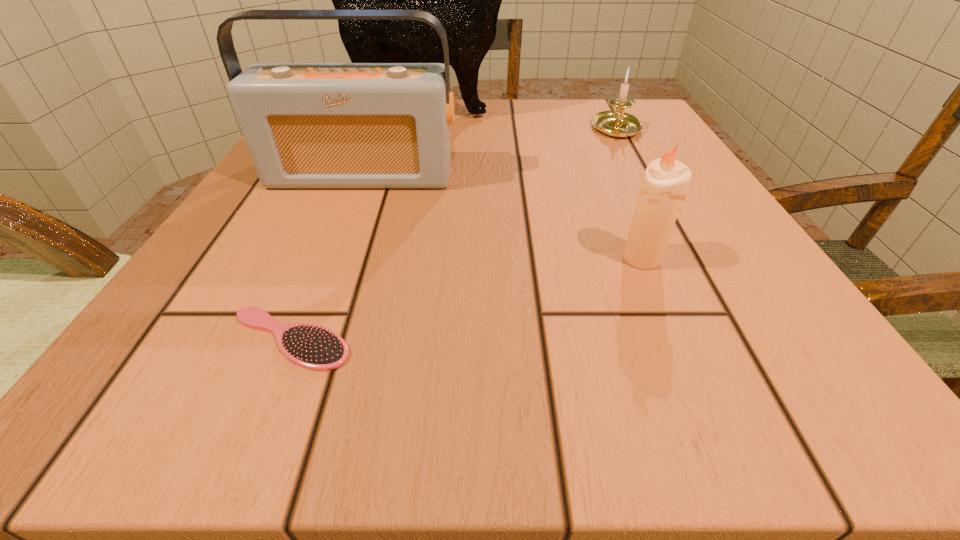
The height and width of the screenshot is (540, 960). I want to click on free space located 0.350m on the back of the third tallest object, so coord(590,137).

The width and height of the screenshot is (960, 540). What are the coordinates of `free spot located on the handle side of the fourth tallest object` in the screenshot? It's located at (690, 264).

Where is `vacant space located on the right of the hairbrush`? This screenshot has height=540, width=960. vacant space located on the right of the hairbrush is located at coordinates (643, 339).

Locate an element on the screen. The image size is (960, 540). cat at the far edge is located at coordinates pyautogui.click(x=466, y=0).

Image resolution: width=960 pixels, height=540 pixels. I want to click on candle holder present at the far edge, so click(x=618, y=124).

Locate an element on the screen. The image size is (960, 540). object at the near edge is located at coordinates (310, 346).

The width and height of the screenshot is (960, 540). What are the coordinates of `cat located at the left edge` in the screenshot? It's located at (466, 0).

This screenshot has width=960, height=540. Find the location of `radio receiver at the left edge`. radio receiver at the left edge is located at coordinates 307,125.

Identify the location of hairbrush positioned at the left edge. (310, 346).

The image size is (960, 540). What are the coordinates of `candle located in the right edge section of the desktop` in the screenshot? It's located at (664, 187).